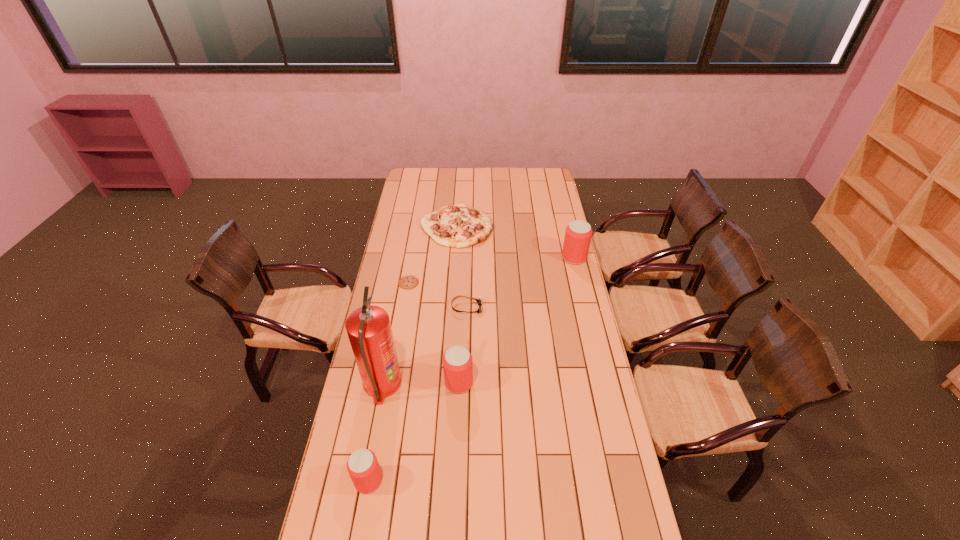
This screenshot has width=960, height=540. Identify the location of pizza present at the left edge. (459, 226).

The height and width of the screenshot is (540, 960). I want to click on fire extinguisher located at the left edge, so click(x=369, y=330).

The width and height of the screenshot is (960, 540). I want to click on object present at the right edge, so click(x=578, y=234).

Locate an element on the screen. The image size is (960, 540). vacant region at the far edge is located at coordinates (433, 183).

This screenshot has height=540, width=960. I want to click on vacant space at the near edge, so 578,510.

Locate an element on the screen. This screenshot has width=960, height=540. vacant space at the left edge of the desktop is located at coordinates (421, 229).

The image size is (960, 540). Find the location of `vacant space at the right edge`. vacant space at the right edge is located at coordinates (586, 467).

In the image, there is a desktop. Where is `vacant region at the far left corner`? The image size is (960, 540). vacant region at the far left corner is located at coordinates (425, 183).

This screenshot has height=540, width=960. I want to click on vacant area at the far right corner of the desktop, so click(546, 182).

The image size is (960, 540). Find the location of `free area in between the second farthest object and the fourth farthest object`. free area in between the second farthest object and the fourth farthest object is located at coordinates (520, 282).